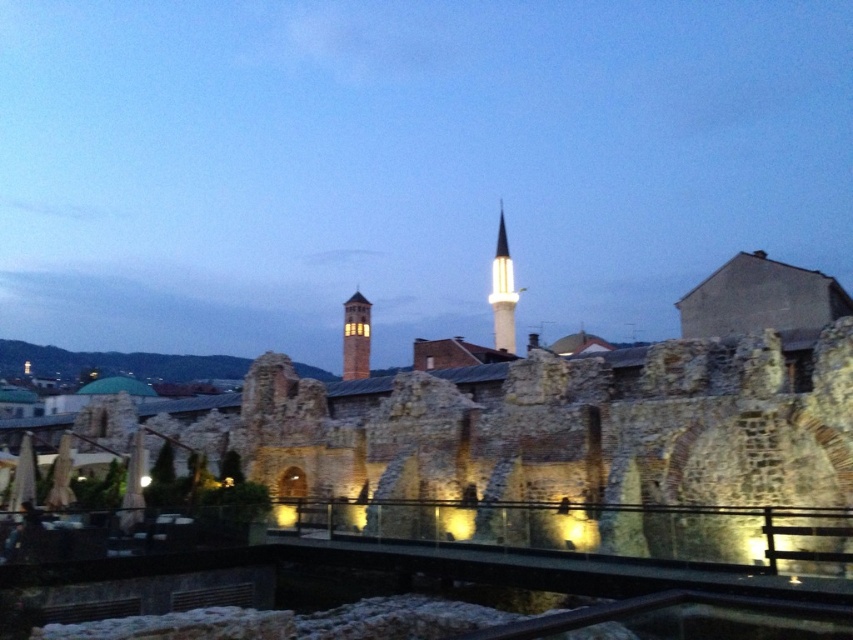
Can you confirm if white marble minaret at center is taller than matte brick tower at center?

Yes.

Does white marble minaret at center have a lesser width compared to matte brick tower at center?

Indeed, white marble minaret at center has a lesser width compared to matte brick tower at center.

Identify the location of white marble minaret at center. This screenshot has width=853, height=640. (502, 291).

Where is `white marble minaret at center`? The height and width of the screenshot is (640, 853). white marble minaret at center is located at coordinates (502, 291).